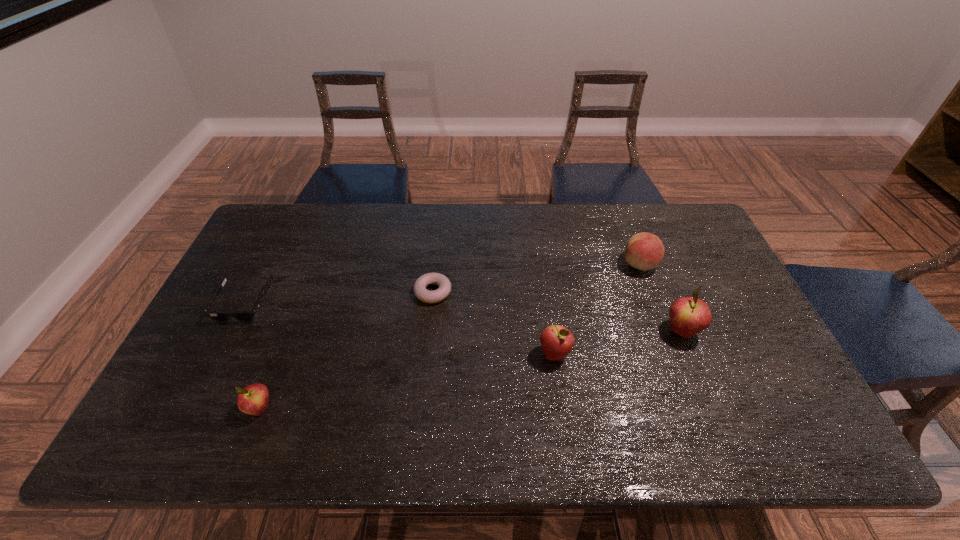
To achieve even spacing by inserting another apple among them, please point to a vacant spot for this new apple. Please provide its 2D coordinates. Your answer should be formatted as a tuple, i.e. [(x, y)], where the tuple contains the x and y coordinates of a point satisfying the conditions above.

[(415, 380)]